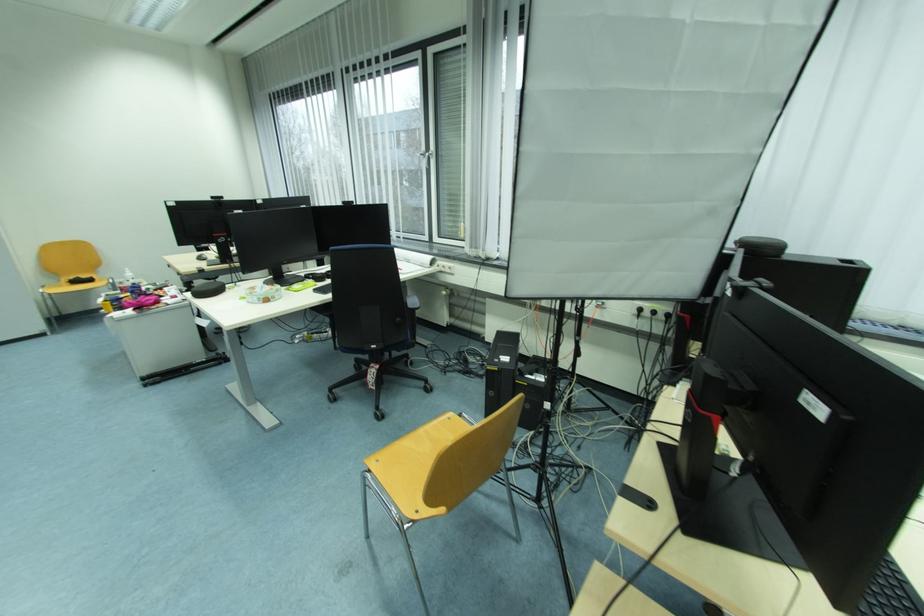
The height and width of the screenshot is (616, 924). What do you see at coordinates (412, 299) in the screenshot? I see `the black chair armrest` at bounding box center [412, 299].